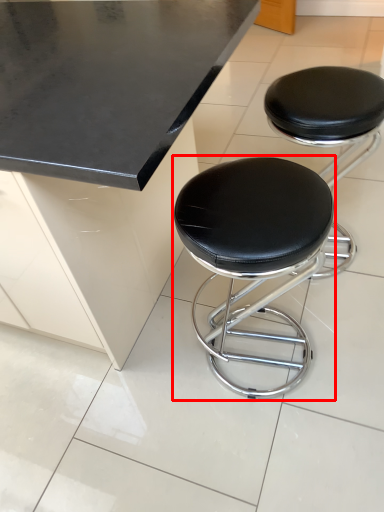
Question: From the image's perspective, where is stool (annotated by the red box) located in relation to stool in the image?

Choices:
 (A) below
 (B) above

Answer: (A)